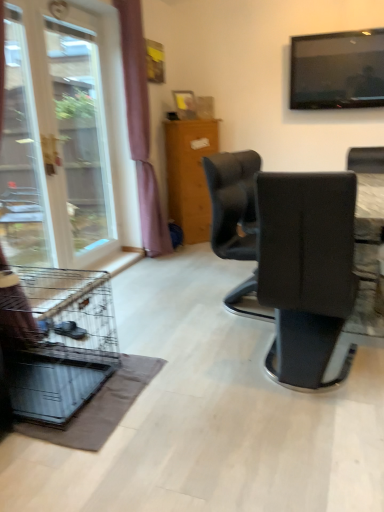
Question: Is black leather chair at center beside transparent glass window at left?

Choices:
 (A) no
 (B) yes

Answer: (A)

Question: Is black leather chair at center outside of transparent glass window at left?

Choices:
 (A) yes
 (B) no

Answer: (A)

Question: Does black leather chair at center turn towards transparent glass window at left?

Choices:
 (A) yes
 (B) no

Answer: (B)

Question: Can you confirm if black leather chair at center is positioned to the right of transparent glass window at left?

Choices:
 (A) yes
 (B) no

Answer: (A)

Question: Does black leather chair at center have a smaller size compared to transparent glass window at left?

Choices:
 (A) yes
 (B) no

Answer: (B)

Question: Is wooden cabinet at center inside the boundaries of transparent glass screen door at left, or outside?

Choices:
 (A) outside
 (B) inside

Answer: (A)

Question: Considering the relative positions of wooden cabinet at center and transparent glass screen door at left in the image provided, is wooden cabinet at center to the left or to the right of transparent glass screen door at left?

Choices:
 (A) left
 (B) right

Answer: (B)

Question: Is wooden cabinet at center bigger or smaller than transparent glass screen door at left?

Choices:
 (A) small
 (B) big

Answer: (B)

Question: Does point [x=178, y=173] appear closer or farther from the camera than point [x=26, y=262]?

Choices:
 (A) farther
 (B) closer

Answer: (A)

Question: From the image's perspective, is transparent glass window at left above or below purple fabric curtain at left?

Choices:
 (A) below
 (B) above

Answer: (A)

Question: From a real-world perspective, is transparent glass window at left above or below purple fabric curtain at left?

Choices:
 (A) below
 (B) above

Answer: (A)

Question: Looking at their shapes, would you say transparent glass window at left is wider or thinner than purple fabric curtain at left?

Choices:
 (A) thin
 (B) wide

Answer: (A)

Question: Which is correct: transparent glass window at left is inside purple fabric curtain at left, or outside of it?

Choices:
 (A) outside
 (B) inside

Answer: (A)

Question: From the image's perspective, is transparent glass window at left positioned above or below wooden cabinet at center?

Choices:
 (A) below
 (B) above

Answer: (B)

Question: Is transparent glass window at left situated inside wooden cabinet at center or outside?

Choices:
 (A) inside
 (B) outside

Answer: (B)